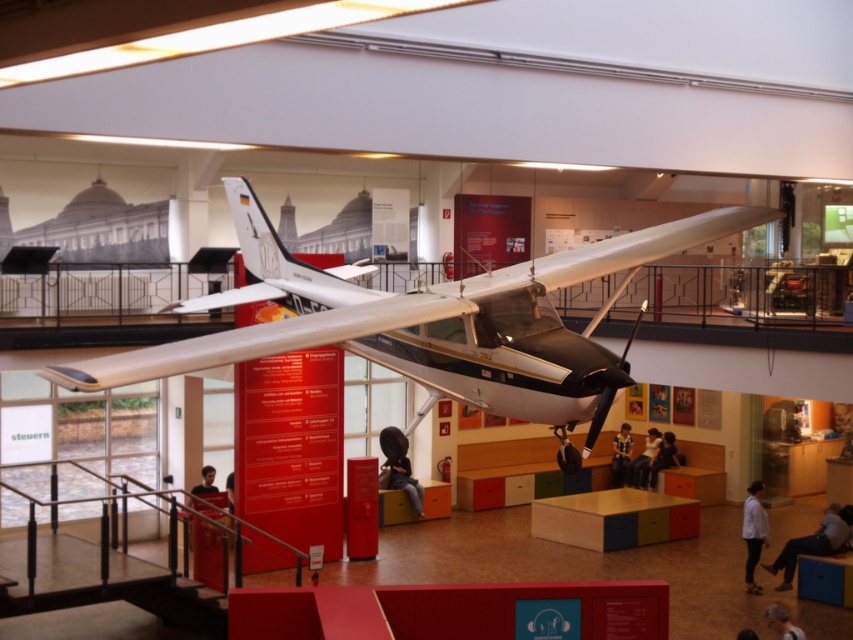
Is point (796, 541) farther from camera compared to point (651, 476)?

No, it is not.

Does point (836, 545) come behind point (647, 481)?

That is False.

Where is `light brown leather shoes at lower right`? The image size is (853, 640). light brown leather shoes at lower right is located at coordinates (814, 541).

Is light brown leather shoes at lower right closer to the viewer compared to black leather shoe at lower center?

No, light brown leather shoes at lower right is further to the viewer.

I want to click on light brown leather shoes at lower right, so (x=814, y=541).

This screenshot has height=640, width=853. I want to click on light brown leather shoes at lower right, so click(x=814, y=541).

Does dark gray fabric jacket at center appear on the left side of white matte shirt at center?

Indeed, dark gray fabric jacket at center is positioned on the left side of white matte shirt at center.

Who is more forward, (x=386, y=477) or (x=758, y=504)?

Point (x=758, y=504) is more forward.

At what (x,y) coordinates should I click in order to perform the action: click on dark gray fabric jacket at center. Please return your answer as a coordinate pair (x, y). The width and height of the screenshot is (853, 640). Looking at the image, I should click on (399, 467).